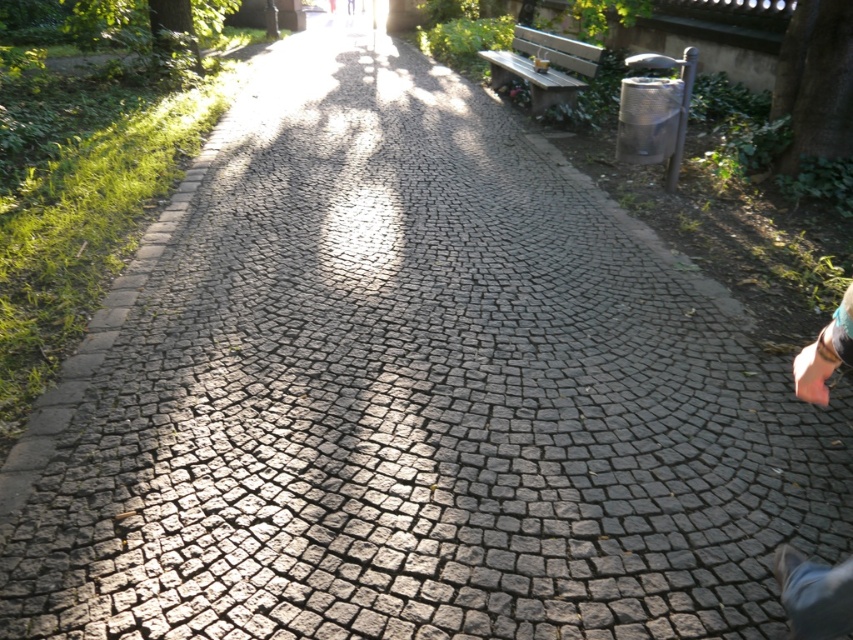
Between light pink fabric at lower right and wooden bench at upper center, which one is positioned higher?

wooden bench at upper center

Image resolution: width=853 pixels, height=640 pixels. Identify the location of light pink fabric at lower right. (814, 595).